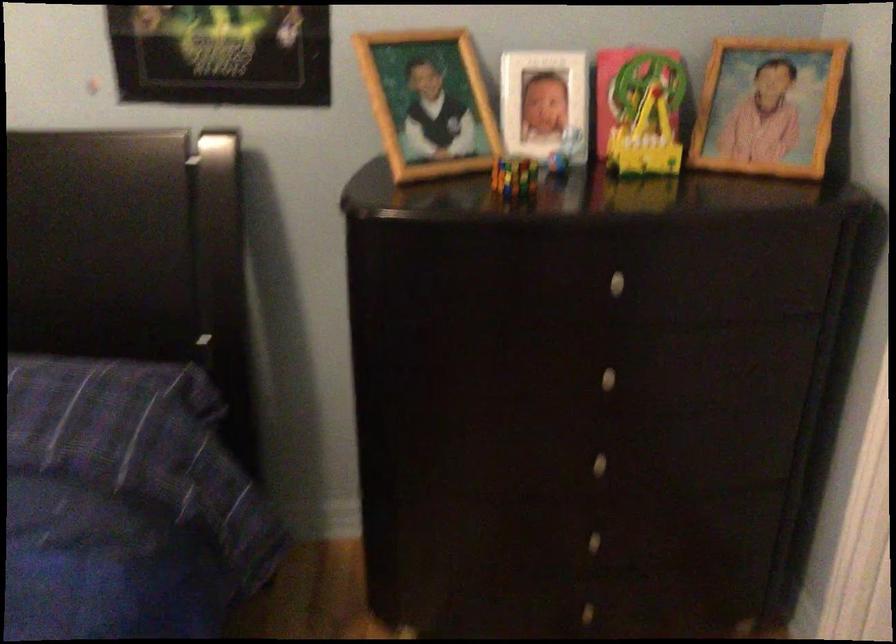
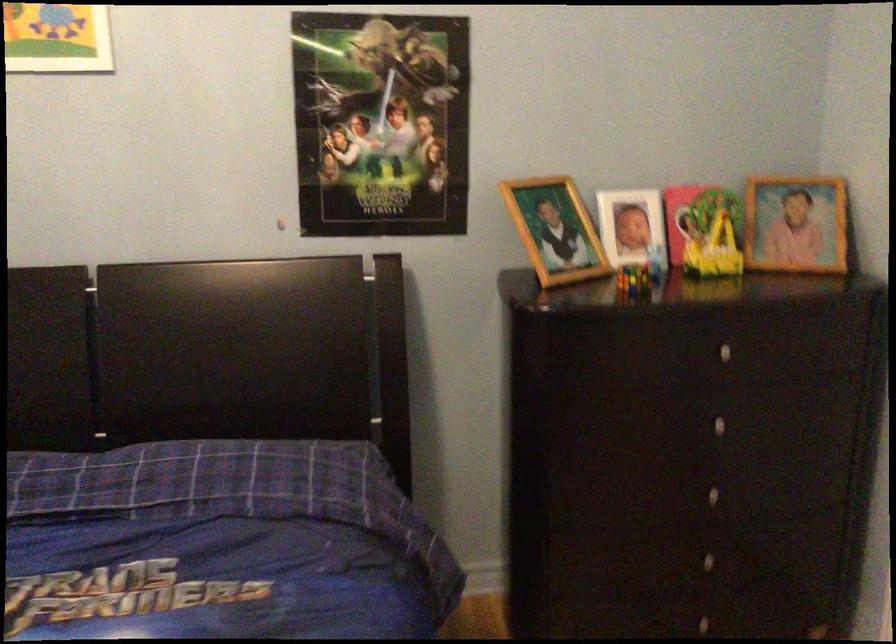
Locate, in the second image, the point that corresponds to (431,109) in the first image.

(555, 230)